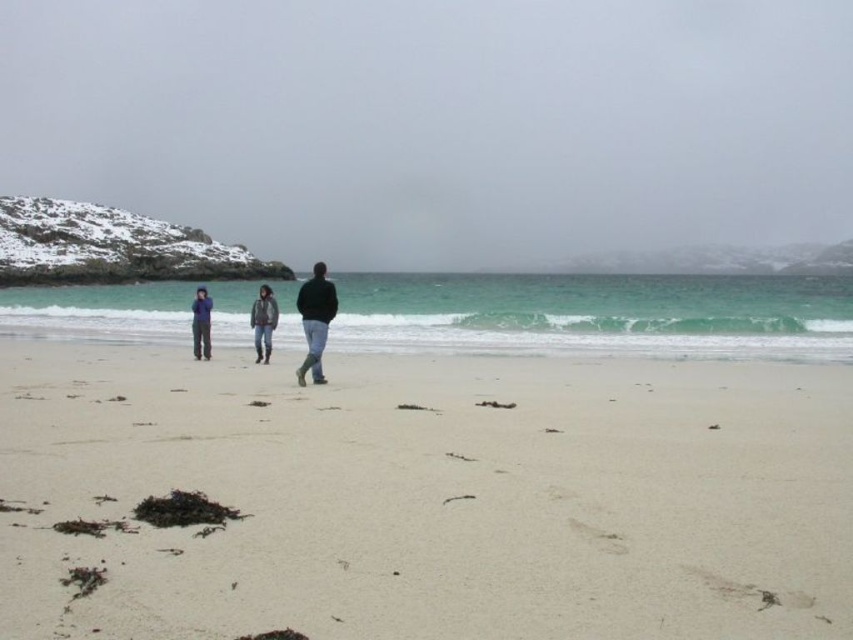
Is denim jacket at center positioned behind blue fleece jacket at center?

No, it is not.

Between denim jacket at center and blue fleece jacket at center, which one appears on the right side from the viewer's perspective?

denim jacket at center

Is point (265, 355) farther from viewer compared to point (206, 307)?

No, it is in front of (206, 307).

Where is `denim jacket at center`? Image resolution: width=853 pixels, height=640 pixels. denim jacket at center is located at coordinates (263, 323).

Describe the element at coordinates (428, 497) in the screenshot. Image resolution: width=853 pixels, height=640 pixels. I see `smooth sand at center` at that location.

Which is behind, point (573, 356) or point (264, 323)?

The point (573, 356) is more distant.

This screenshot has height=640, width=853. What do you see at coordinates (428, 497) in the screenshot?
I see `smooth sand at center` at bounding box center [428, 497].

You are a GUI agent. You are given a task and a screenshot of the screen. Output one action in this format:
    pyautogui.click(x=<x>, y=<y>)
    Task: Click on the smooth sand at center
    This screenshot has height=640, width=853.
    Given the screenshot: What is the action you would take?
    pyautogui.click(x=428, y=497)

Can you confirm if smooth sand at center is wider than white sand at center?

Incorrect, smooth sand at center's width does not surpass white sand at center's.

Is point (613, 397) behind point (422, 243)?

No, it is not.

You are a GUI agent. You are given a task and a screenshot of the screen. Output one action in this format:
    pyautogui.click(x=<x>, y=<y>)
    Task: Click on the smooth sand at center
    The width and height of the screenshot is (853, 640).
    Given the screenshot: What is the action you would take?
    pyautogui.click(x=428, y=497)